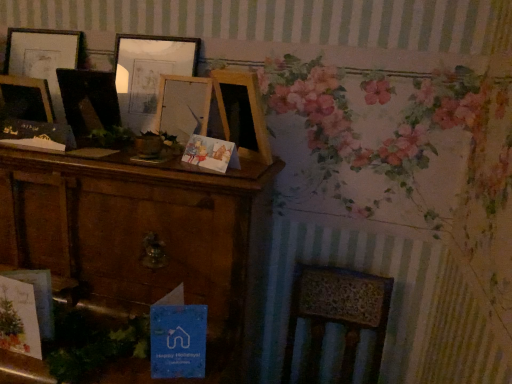
Question: Is wooden picture frame at upper left, the third picture frame when ordered from right to left, wider or thinner than wooden radiator at lower right?

Choices:
 (A) wide
 (B) thin

Answer: (B)

Question: Is wooden picture frame at upper left, the third picture frame when ordered from right to left, to the left or to the right of wooden radiator at lower right in the image?

Choices:
 (A) right
 (B) left

Answer: (B)

Question: Which object is the farthest from the wooden radiator at lower right?

Choices:
 (A) wooden picture frame at left, which is the 2th picture frame from left to right
 (B) wooden picture frame at upper left, the third picture frame when ordered from right to left
 (C) brown wood cabinet at left
 (D) wooden picture frame at center, which is the third picture frame in left-to-right order
 (E) blue paper postcard at lower center

Answer: (B)

Question: Estimate the real-world distances between objects in this image. Which object is farther from the wooden picture frame at left, which is the 2th picture frame from left to right?

Choices:
 (A) wooden picture frame at center, placed as the first picture frame when sorted from right to left
 (B) wooden radiator at lower right
 (C) blue paper postcard at lower center
 (D) brown wood cabinet at left
 (E) wooden picture frame at upper left, the first picture frame when ordered from left to right

Answer: (B)